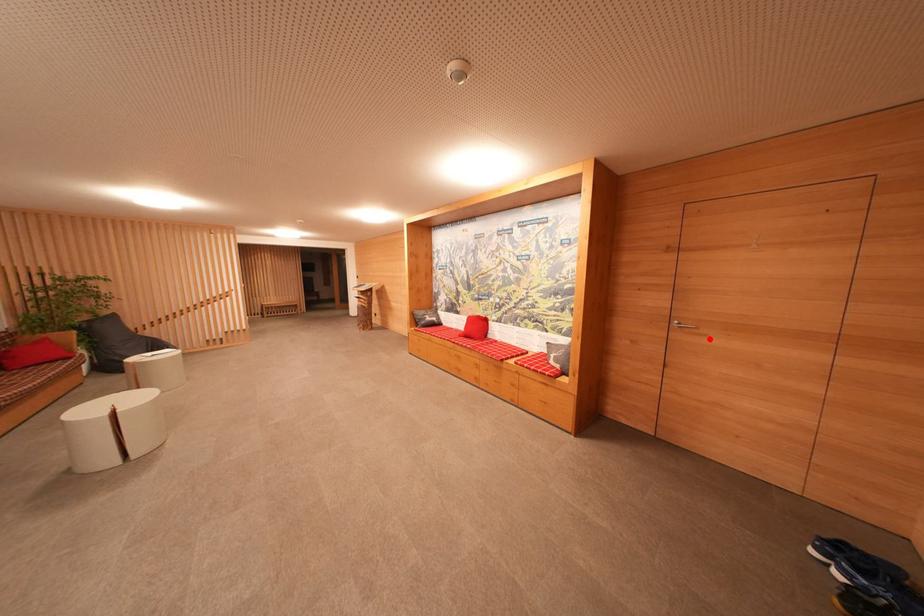
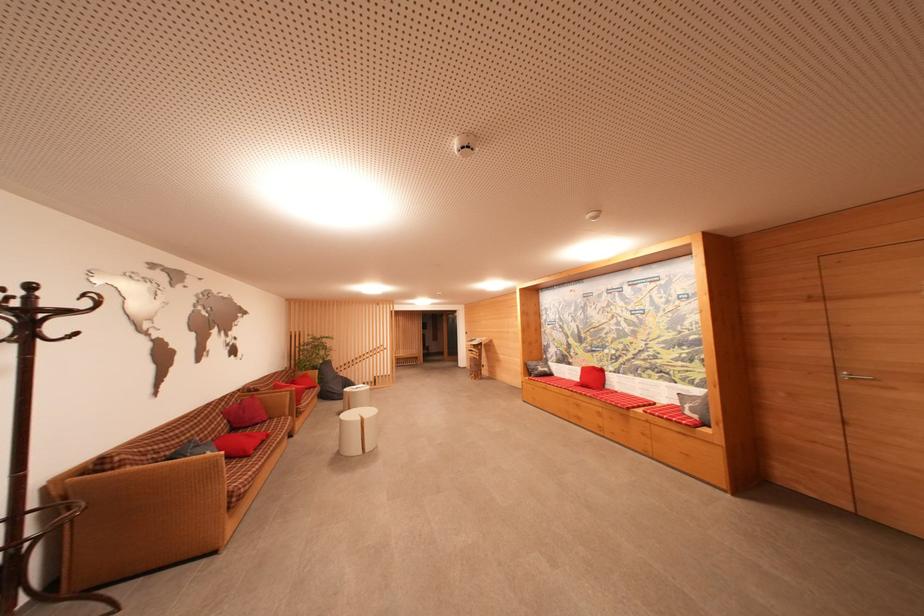
In the second image, find the point that corresponds to the highlighted location in the first image.

(898, 392)